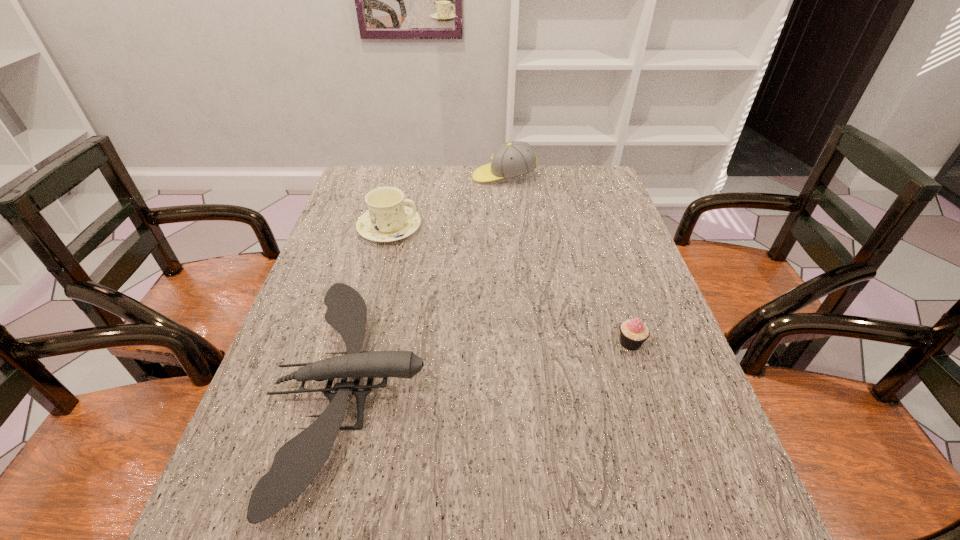
Where is `free space between the baseball cap and the drone`? free space between the baseball cap and the drone is located at coordinates (428, 282).

You are a GUI agent. You are given a task and a screenshot of the screen. Output one action in this format:
    pyautogui.click(x=<x>, y=<y>)
    Task: Click on the free space between the third nearest object and the second object from right to left
    Image resolution: width=960 pixels, height=540 pixels.
    Given the screenshot: What is the action you would take?
    pyautogui.click(x=446, y=202)

You are a GUI agent. You are given a task and a screenshot of the screen. Output one action in this format:
    pyautogui.click(x=<x>, y=<y>)
    Task: Click on the object that can be found as the closest to the third object from left to right
    
    Given the screenshot: What is the action you would take?
    pyautogui.click(x=388, y=219)

Identify which object is located as the nearest to the shortest object. Please provide its 2D coordinates. Your answer should be formatted as a tuple, i.e. [(x, y)], where the tuple contains the x and y coordinates of a point satisfying the conditions above.

[(295, 465)]

The image size is (960, 540). In order to click on blank area in the image that satisfies the following two spatial constraints: 1. on the handle side of the rightmost object; 2. on the right side of the chinaware in this screenshot , I will do `click(360, 343)`.

Where is `vacant space that satisfies the following two spatial constraints: 1. on the handle side of the rightmost object; 2. on the left side of the chinaware`? The width and height of the screenshot is (960, 540). vacant space that satisfies the following two spatial constraints: 1. on the handle side of the rightmost object; 2. on the left side of the chinaware is located at coordinates (360, 343).

Where is `free location that satisfies the following two spatial constraints: 1. on the front side of the shortest object; 2. at the head of the drone`? free location that satisfies the following two spatial constraints: 1. on the front side of the shortest object; 2. at the head of the drone is located at coordinates (645, 388).